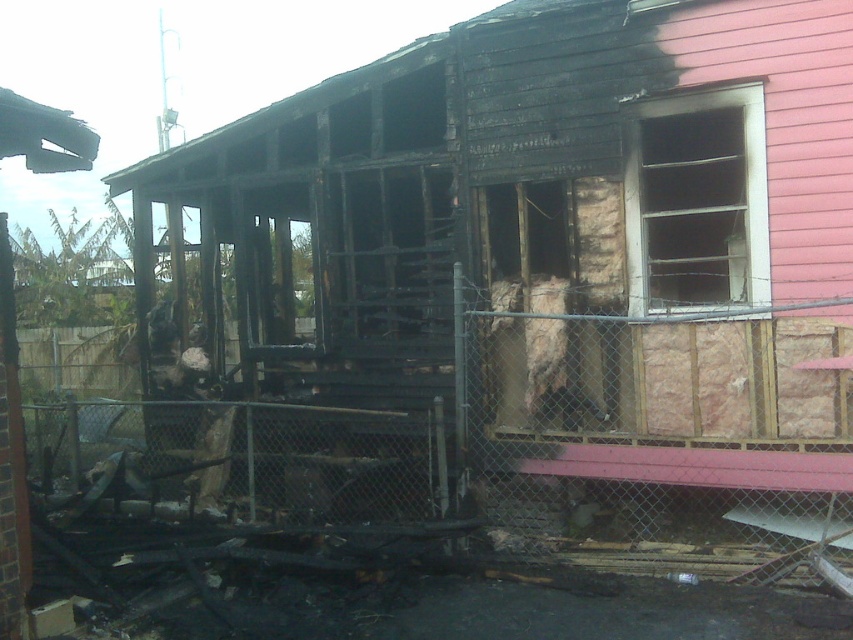
Does point (120, 401) lie in front of point (595, 554)?

No, it is behind (595, 554).

Locate an element on the screen. rusty chain-link fence at center is located at coordinates (648, 488).